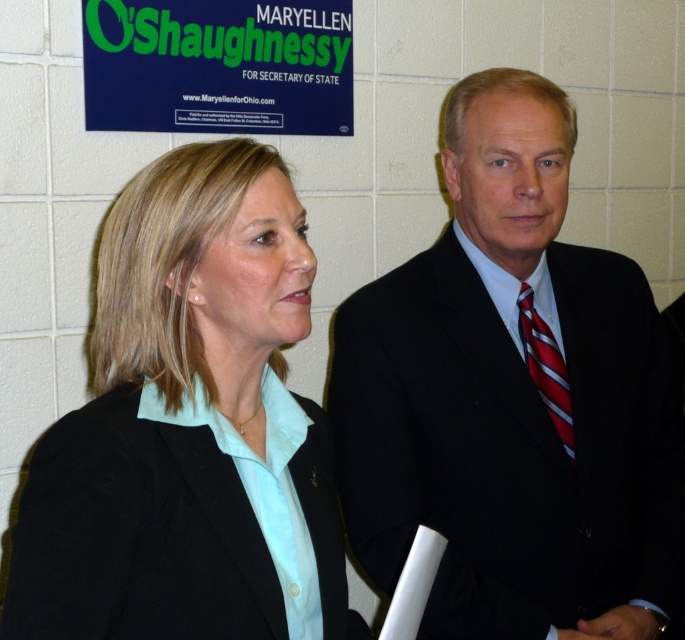
Question: Which object appears closest to the camera in this image?

Choices:
 (A) green plastic signboard at upper left
 (B) matte black blazer at center
 (C) red striped tie at right

Answer: (B)

Question: Which of the following is the closest to the observer?

Choices:
 (A) (503, 378)
 (B) (53, 428)
 (C) (129, 92)
 (D) (560, 372)

Answer: (B)

Question: Does black suit at center have a larger size compared to matte black blazer at center?

Choices:
 (A) no
 (B) yes

Answer: (B)

Question: Among these objects, which one is nearest to the camera?

Choices:
 (A) black suit at center
 (B) red striped tie at right
 (C) matte black blazer at center

Answer: (C)

Question: Does black suit at center have a lesser width compared to red striped tie at right?

Choices:
 (A) yes
 (B) no

Answer: (B)

Question: Is black suit at center to the left of red striped tie at right from the viewer's perspective?

Choices:
 (A) no
 (B) yes

Answer: (B)